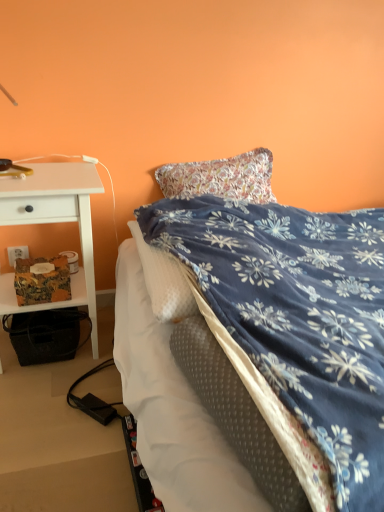
Question: Considering the relative sizes of white plastic power outlet at lower left and blue floral blanket at center in the image provided, is white plastic power outlet at lower left bigger than blue floral blanket at center?

Choices:
 (A) yes
 (B) no

Answer: (B)

Question: Is white plastic power outlet at lower left directly adjacent to blue floral blanket at center?

Choices:
 (A) yes
 (B) no

Answer: (B)

Question: Is white plastic power outlet at lower left not within blue floral blanket at center?

Choices:
 (A) no
 (B) yes

Answer: (B)

Question: Can you confirm if white plastic power outlet at lower left is shorter than blue floral blanket at center?

Choices:
 (A) no
 (B) yes

Answer: (B)

Question: Can you confirm if white plastic power outlet at lower left is thinner than blue floral blanket at center?

Choices:
 (A) no
 (B) yes

Answer: (B)

Question: Which is correct: white wood desk at left is inside blue floral blanket at center, or outside of it?

Choices:
 (A) inside
 (B) outside

Answer: (B)

Question: Would you say white wood desk at left is to the left or to the right of blue floral blanket at center in the picture?

Choices:
 (A) right
 (B) left

Answer: (B)

Question: Considering the positions of point (14, 309) and point (362, 461), is point (14, 309) closer or farther from the camera than point (362, 461)?

Choices:
 (A) closer
 (B) farther

Answer: (B)

Question: In terms of width, does white wood desk at left look wider or thinner when compared to blue floral blanket at center?

Choices:
 (A) wide
 (B) thin

Answer: (B)

Question: Is point 236,348 closer or farther from the camera than point 0,200?

Choices:
 (A) farther
 (B) closer

Answer: (B)

Question: Considering their positions, is blue floral blanket at center located in front of or behind white wood desk at left?

Choices:
 (A) front
 (B) behind

Answer: (A)

Question: From a real-world perspective, is blue floral blanket at center above or below white wood desk at left?

Choices:
 (A) above
 (B) below

Answer: (B)

Question: Considering the positions of blue floral blanket at center and white wood desk at left in the image, is blue floral blanket at center wider or thinner than white wood desk at left?

Choices:
 (A) wide
 (B) thin

Answer: (A)

Question: From the image's perspective, relative to white plastic power outlet at lower left, is white wood desk at left above or below?

Choices:
 (A) below
 (B) above

Answer: (A)

Question: Considering the positions of white wood desk at left and white plastic power outlet at lower left in the image, is white wood desk at left wider or thinner than white plastic power outlet at lower left?

Choices:
 (A) wide
 (B) thin

Answer: (A)